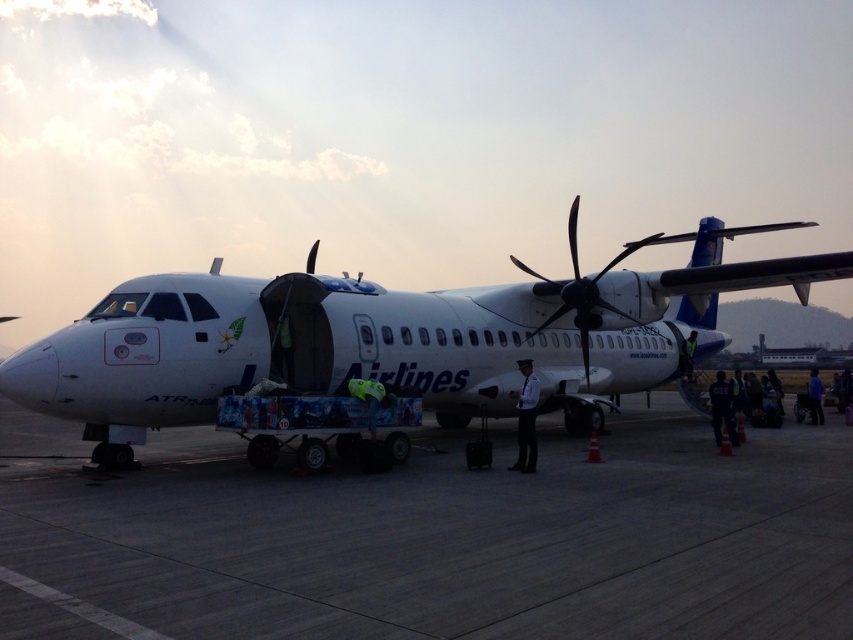
Question: Can you confirm if white matte airplane at center is wider than white uniform at center?

Choices:
 (A) no
 (B) yes

Answer: (B)

Question: Considering the relative positions of white matte airplane at center and blue fabric jacket at right in the image provided, where is white matte airplane at center located with respect to blue fabric jacket at right?

Choices:
 (A) right
 (B) left

Answer: (B)

Question: Which is farther from the blue fabric jacket at right?

Choices:
 (A) concrete tarmac at center
 (B) white uniform at center
 (C) white matte airplane at center

Answer: (A)

Question: Among these objects, which one is nearest to the camera?

Choices:
 (A) blue fabric jacket at right
 (B) concrete tarmac at center
 (C) white uniform at center
 (D) black metallic propeller at center

Answer: (B)

Question: Among these points, which one is nearest to the camera?

Choices:
 (A) (512, 390)
 (B) (120, 596)
 (C) (816, 371)
 (D) (595, 300)

Answer: (B)

Question: Considering the relative positions of black metallic propeller at center and blue fabric jacket at right in the image provided, where is black metallic propeller at center located with respect to blue fabric jacket at right?

Choices:
 (A) below
 (B) above

Answer: (B)